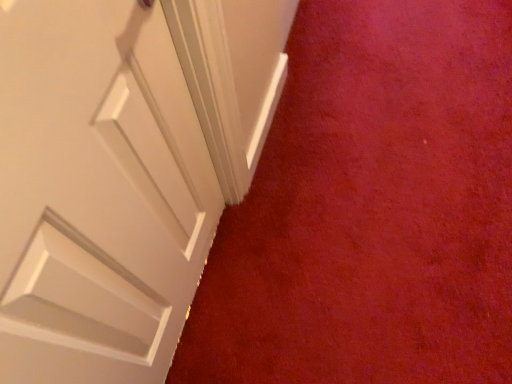
The image size is (512, 384). What do you see at coordinates (371, 208) in the screenshot?
I see `matte white door at upper left` at bounding box center [371, 208].

Locate an element on the screen. Image resolution: width=512 pixels, height=384 pixels. matte white door at upper left is located at coordinates (371, 208).

You are a GUI agent. You are given a task and a screenshot of the screen. Output one action in this format:
    pyautogui.click(x=<x>, y=<y>)
    Task: Click on the white matte door at upper left
    
    Given the screenshot: What is the action you would take?
    pyautogui.click(x=97, y=193)

What is the approximate width of white matte door at upper left?

It is 2.82 inches.

This screenshot has height=384, width=512. What do you see at coordinates (97, 193) in the screenshot? I see `white matte door at upper left` at bounding box center [97, 193].

At what (x,y) coordinates should I click in order to perform the action: click on matte white door at upper left. Please return your answer as a coordinate pair (x, y). This screenshot has width=512, height=384. Looking at the image, I should click on (371, 208).

Does white matte door at upper left appear on the right side of matte white door at upper left?

Incorrect, white matte door at upper left is not on the right side of matte white door at upper left.

Which is behind, white matte door at upper left or matte white door at upper left?

matte white door at upper left.

Which is behind, point (23, 128) or point (409, 235)?

The point (409, 235) is more distant.

From the image's perspective, between white matte door at upper left and matte white door at upper left, which one is located above?

matte white door at upper left is shown above in the image.

From a real-world perspective, does white matte door at upper left sit lower than matte white door at upper left?

No, from a real-world perspective, white matte door at upper left is not under matte white door at upper left.

From the picture: Can you confirm if white matte door at upper left is thinner than matte white door at upper left?

Yes, white matte door at upper left is thinner than matte white door at upper left.

Who is shorter, white matte door at upper left or matte white door at upper left?

matte white door at upper left is shorter.

Is white matte door at upper left bigger than matte white door at upper left?

No, white matte door at upper left is not bigger than matte white door at upper left.

Is white matte door at upper left outside of matte white door at upper left?

Yes, white matte door at upper left is outside of matte white door at upper left.

Consider the image. Can you see white matte door at upper left touching matte white door at upper left?

white matte door at upper left and matte white door at upper left are clearly separated.

Is matte white door at upper left at the back of white matte door at upper left?

white matte door at upper left is not turned away from matte white door at upper left.

Can you tell me how much white matte door at upper left and matte white door at upper left differ in facing direction?

The angle between the facing direction of white matte door at upper left and the facing direction of matte white door at upper left is 90 degrees.

How distant is white matte door at upper left from matte white door at upper left?

white matte door at upper left is 24.28 inches away from matte white door at upper left.

Image resolution: width=512 pixels, height=384 pixels. I want to click on door located on the left of matte white door at upper left, so click(97, 193).

Is matte white door at upper left at the right side of white matte door at upper left?

Correct, you'll find matte white door at upper left to the right of white matte door at upper left.

Between matte white door at upper left and white matte door at upper left, which one is positioned behind?

matte white door at upper left is behind.

Is point (365, 4) positioned behind point (87, 186)?

Yes, it is behind point (87, 186).

From the image's perspective, who appears lower, matte white door at upper left or white matte door at upper left?

white matte door at upper left is shown below in the image.

From a real-world perspective, which is physically below, matte white door at upper left or white matte door at upper left?

In real-world perspective, matte white door at upper left is lower.

Which of these two, matte white door at upper left or white matte door at upper left, is thinner?

With smaller width is white matte door at upper left.

Can you confirm if matte white door at upper left is shorter than white matte door at upper left?

Yes.

Considering the sizes of objects matte white door at upper left and white matte door at upper left in the image provided, who is bigger, matte white door at upper left or white matte door at upper left?

Bigger between the two is matte white door at upper left.

Would you say matte white door at upper left is outside white matte door at upper left?

Yes, matte white door at upper left is outside of white matte door at upper left.

Is matte white door at upper left touching white matte door at upper left?

No, matte white door at upper left is not with white matte door at upper left.

Is matte white door at upper left looking in the opposite direction of white matte door at upper left?

No, matte white door at upper left's orientation is not away from white matte door at upper left.

How many degrees apart are the facing directions of matte white door at upper left and white matte door at upper left?

The facing directions of matte white door at upper left and white matte door at upper left are 90 degrees apart.

Where is `plain on the right of white matte door at upper left`? The height and width of the screenshot is (384, 512). plain on the right of white matte door at upper left is located at coordinates (371, 208).

In order to click on plain on the right of white matte door at upper left in this screenshot , I will do `click(371, 208)`.

At what (x,y) coordinates should I click in order to perform the action: click on plain below the white matte door at upper left (from a real-world perspective). Please return your answer as a coordinate pair (x, y). Looking at the image, I should click on click(371, 208).